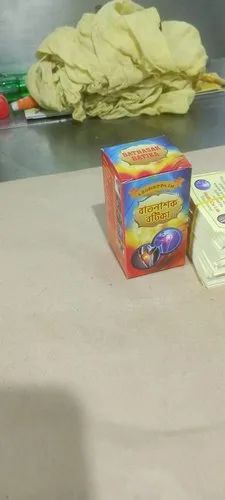
You are a GUI agent. You are given a task and a screenshot of the screen. Output one action in this format:
    pyautogui.click(x=<x>, y=<y>)
    Task: Click on the shadow box bottom left
    
    Given the screenshot: What is the action you would take?
    pyautogui.click(x=27, y=437)